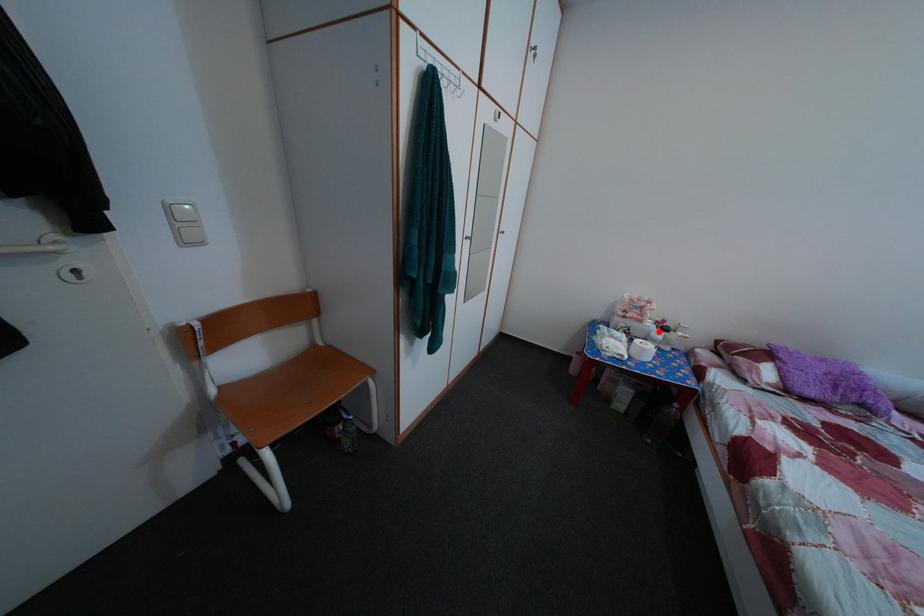
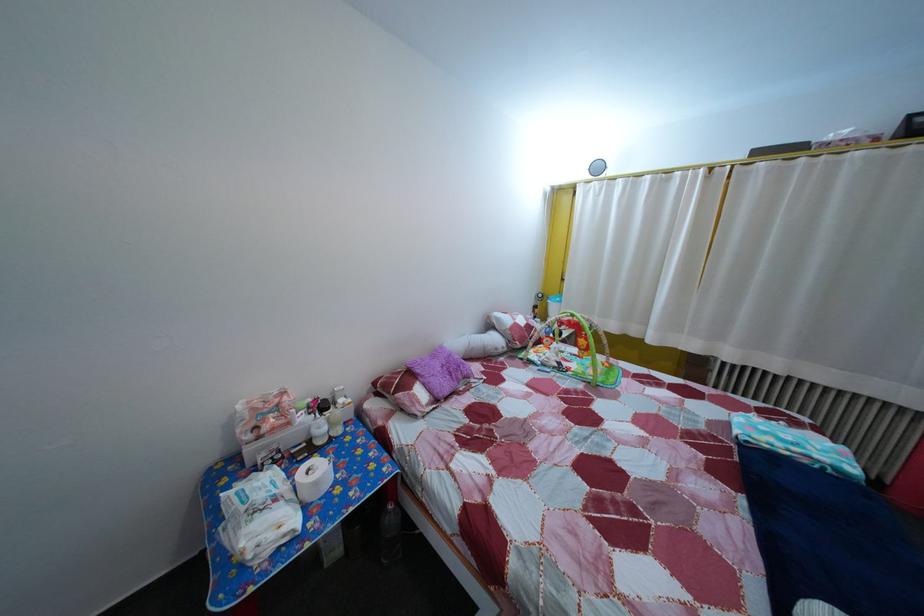
In the second image, find the point that corresponds to the highlighted location in the first image.

(311, 427)